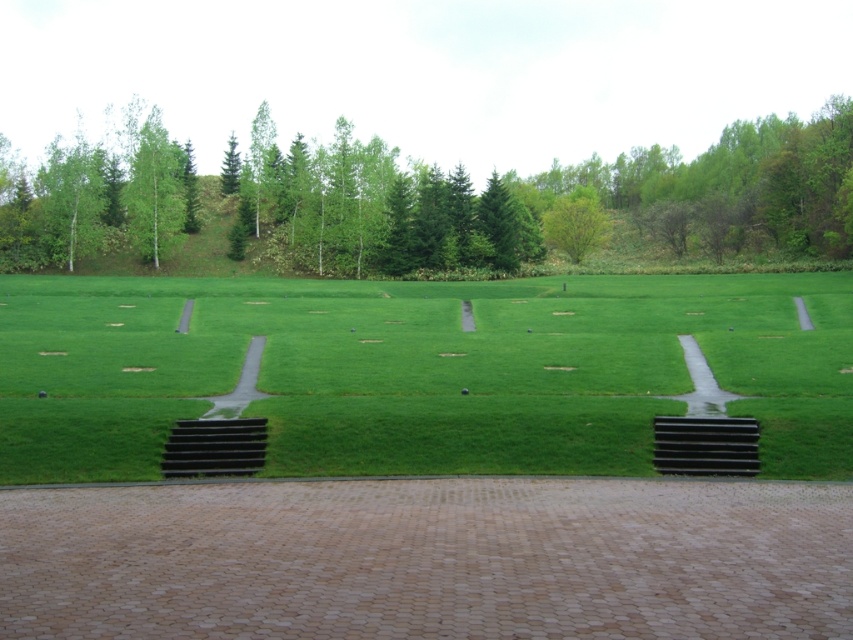
You are standing on the paved brick area in the foreground of the garden. You want to walk towards the green leafy tree at upper center. Which direction should you move relative to the green grass at center?

The green grass at center is located below the green leafy tree at upper center, so to reach the tree, you should move upward from the green grass at center.

Based on the coordinates provided in the scene description, where is the green leafy tree at upper right located?

The green leafy tree at upper right is located at point (732,186).

Looking at this image, you are standing at the point marked by the coordinates point (418, 371) in the image. What is the terrain like under your feet?

The point (418, 371) marks green grass at center, so the terrain under your feet is green grass.